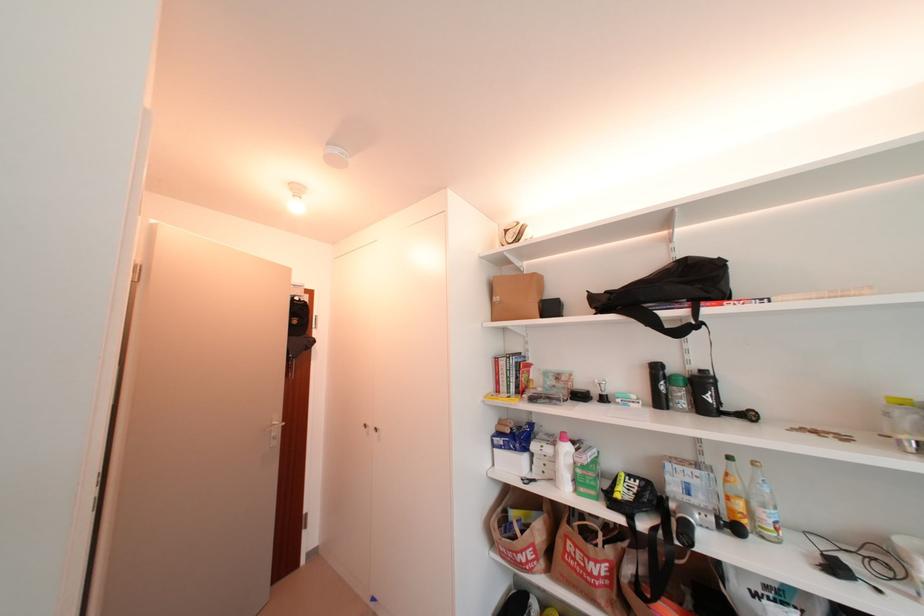
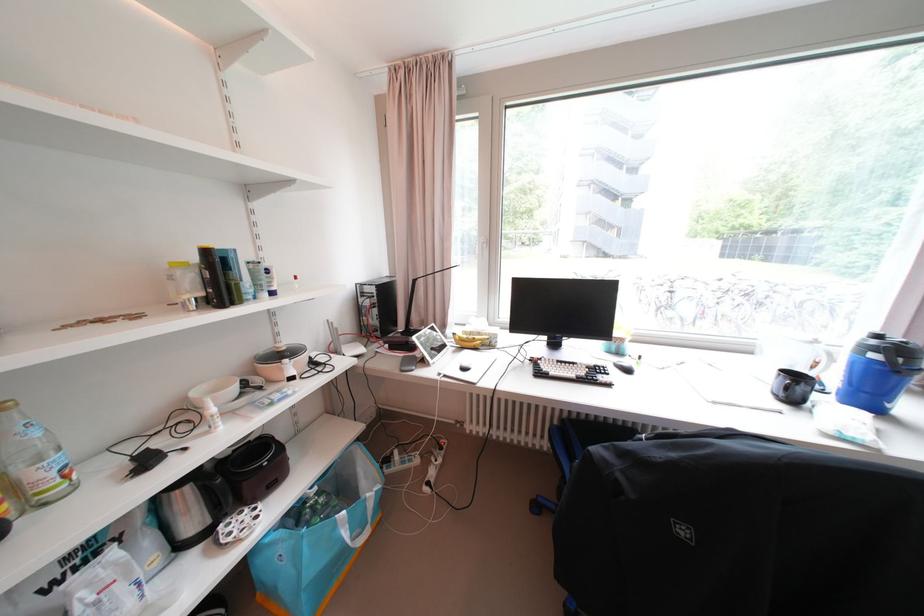
In the second image, find the point that corresponds to point (761, 464) in the first image.

(6, 410)